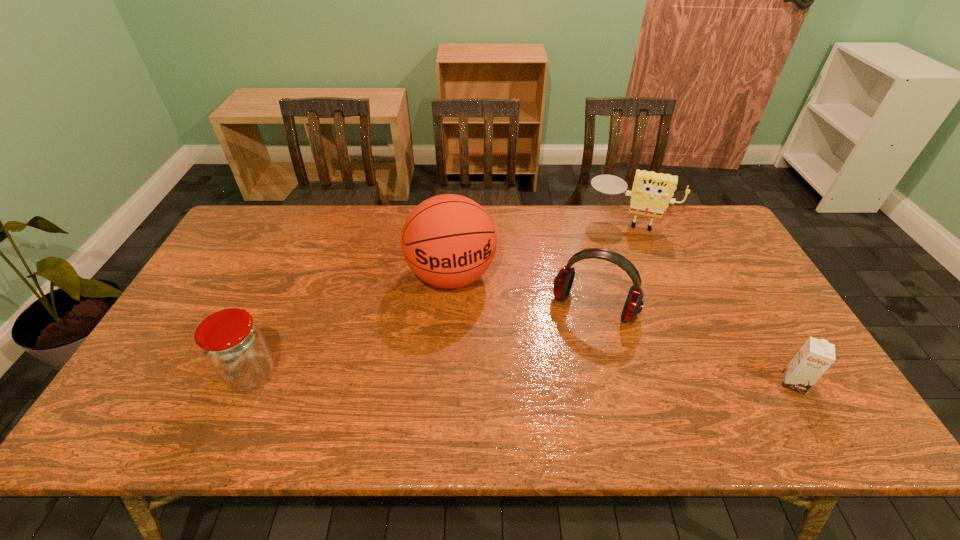
Identify the location of blank area located 0.100m on the front-facing side of the sponge. (614, 250).

This screenshot has width=960, height=540. I want to click on free space located on the front-facing side of the sponge, so click(612, 262).

Where is `vacant area situated 0.190m on the side with logo of the basketball`? The image size is (960, 540). vacant area situated 0.190m on the side with logo of the basketball is located at coordinates (474, 362).

Where is `vacant area situated 0.160m on the side with logo of the basketball`? The image size is (960, 540). vacant area situated 0.160m on the side with logo of the basketball is located at coordinates (471, 353).

You are a GUI agent. You are given a task and a screenshot of the screen. Output one action in this format:
    pyautogui.click(x=<x>, y=<y>)
    Task: Click on the vacant space located 0.190m on the side with logo of the basketball
    This screenshot has width=960, height=540.
    Given the screenshot: What is the action you would take?
    pyautogui.click(x=474, y=362)

Image resolution: width=960 pixels, height=540 pixels. Identify the location of vacant space situated 0.060m on the ear cups of the earphone. (574, 345).

Where is `vacant area situated 0.070m on the ear cups of the earphone`? vacant area situated 0.070m on the ear cups of the earphone is located at coordinates tap(572, 347).

Find the location of `vacant space located 0.120m on the ear cups of the earphone`. vacant space located 0.120m on the ear cups of the earphone is located at coordinates (566, 362).

Locate an element on the screen. sponge that is at the far edge is located at coordinates (651, 192).

Where is `basketball that is at the far edge`? basketball that is at the far edge is located at coordinates (449, 241).